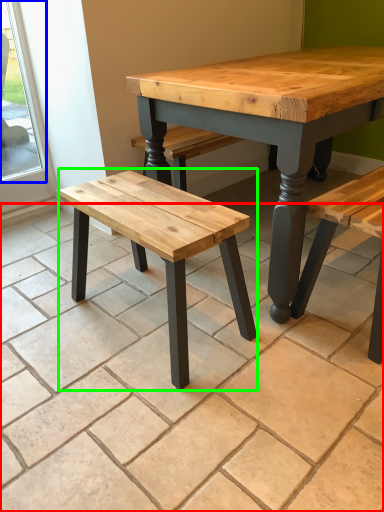
Question: Which object is positioned closest to tile (highlighted by a red box)? Select from window (highlighted by a blue box) and stool (highlighted by a green box).

Choices:
 (A) window
 (B) stool

Answer: (B)